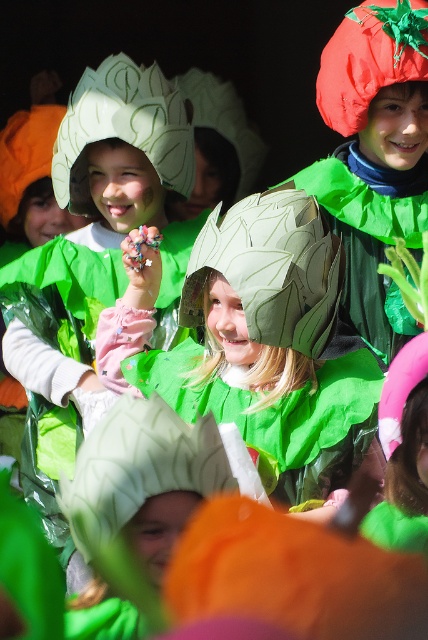
You are a costume designer observing the children in the scene. You need to determine which of the two items, the matte green leaf at center or the green paper headdress at upper center, is smaller in size. Which one is it?

The matte green leaf at center is smaller in size compared to the green paper headdress at upper center.

You are a photographer trying to capture a group photo of the matte green paper headdress at center and the green paper leaf at center. Since you want to ensure both are visible in the frame, which object should you position closer to the camera to avoid being blocked by the other?

The matte green paper headdress at center should be positioned closer to the camera because it is on the left side of the green paper leaf at center. By placing it in front, it won t block the leaf and both will be visible.

Looking at this image, you are a photographer trying to capture the green paper leaf at center in a closeup shot. Based on its position at point coordinates, is it closer to the left or right side of the image?

The green paper leaf at center is located at point coordinates, so it is closer to the left side of the image.